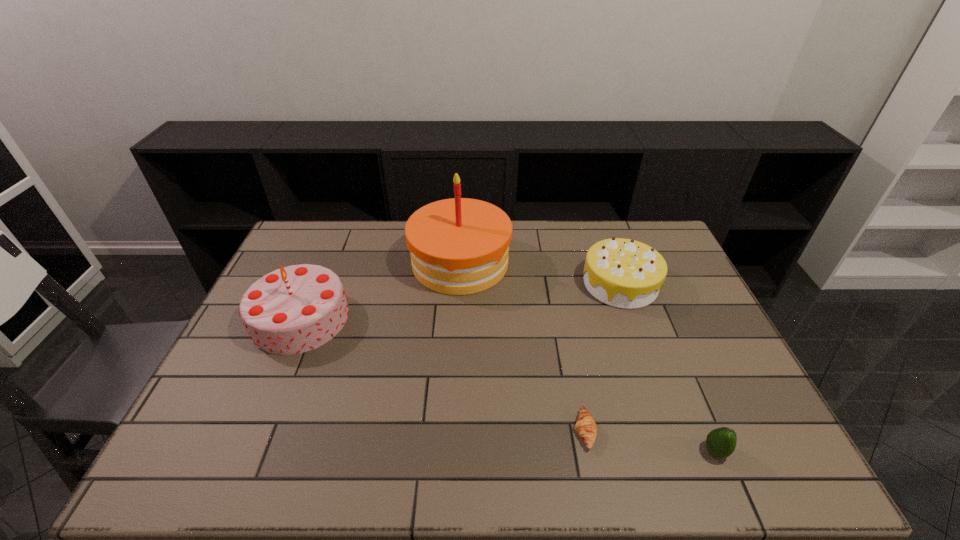
Find the location of a particular element. free space that is in between the second shortest object and the rightmost birthday cake is located at coordinates (667, 368).

Image resolution: width=960 pixels, height=540 pixels. What are the coordinates of `free space between the third tallest object and the pastry` in the screenshot? It's located at (603, 357).

Where is `vacant area between the tallest birthday cake and the rightmost birthday cake`? vacant area between the tallest birthday cake and the rightmost birthday cake is located at coordinates (540, 273).

I want to click on empty space between the shortest object and the second birthday cake from left to right, so click(x=522, y=347).

Locate an element on the screen. The width and height of the screenshot is (960, 540). vacant area that lies between the second birthday cake from right to left and the shortest object is located at coordinates (522, 347).

Identify the location of free spot between the third object from left to right and the second tallest object. The height and width of the screenshot is (540, 960). (443, 375).

The width and height of the screenshot is (960, 540). What are the coordinates of `vacant area that lies between the third shortest object and the third object from right to left` in the screenshot? It's located at (603, 357).

Locate an element on the screen. The height and width of the screenshot is (540, 960). vacant area that lies between the second birthday cake from left to right and the second shortest object is located at coordinates (588, 357).

Select which object appears as the second closest to the shortest birthday cake. Please provide its 2D coordinates. Your answer should be formatted as a tuple, i.e. [(x, y)], where the tuple contains the x and y coordinates of a point satisfying the conditions above.

[(585, 425)]

Identify which object is the fourth nearest to the shortest object. Please provide its 2D coordinates. Your answer should be formatted as a tuple, i.e. [(x, y)], where the tuple contains the x and y coordinates of a point satisfying the conditions above.

[(295, 309)]